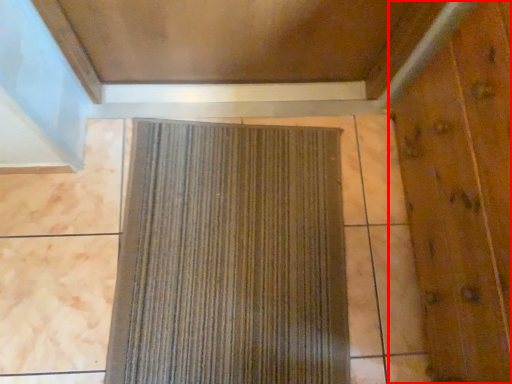
Question: From the image's perspective, considering the relative positions of elevator door (annotated by the red box) and curtain in the image provided, where is elevator door (annotated by the red box) located with respect to the staircase?

Choices:
 (A) above
 (B) below

Answer: (A)